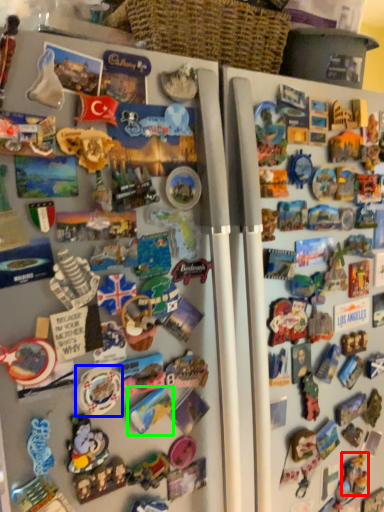
Question: Based on their relative distances, which object is nearer to toy (highlighted by a red box)? Choose from toy (highlighted by a blue box) and toy (highlighted by a green box).

Choices:
 (A) toy
 (B) toy

Answer: (B)